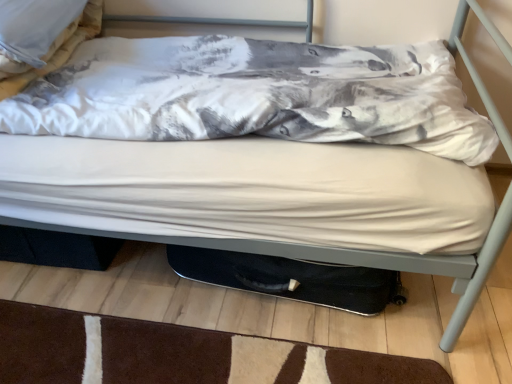
Find the location of a particular element. Image resolution: width=512 pixels, height=384 pixels. vacant space underneath brown plush rug at lower center (from a real-world perspective) is located at coordinates (180, 356).